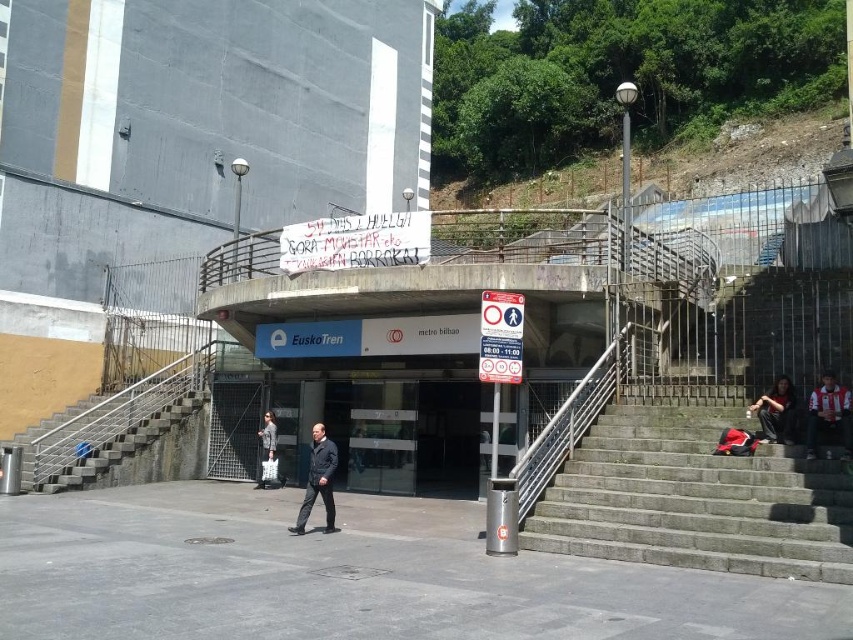
You are a photographer at the metro station entrance. You need to capture a photo of the white and red striped shirt at lower right and dark blue jeans at lower right. Based on their positions, which clothing item is positioned higher in the image?

The white and red striped shirt at lower right is above dark blue jeans at lower right, so the shirt is positioned higher in the image.